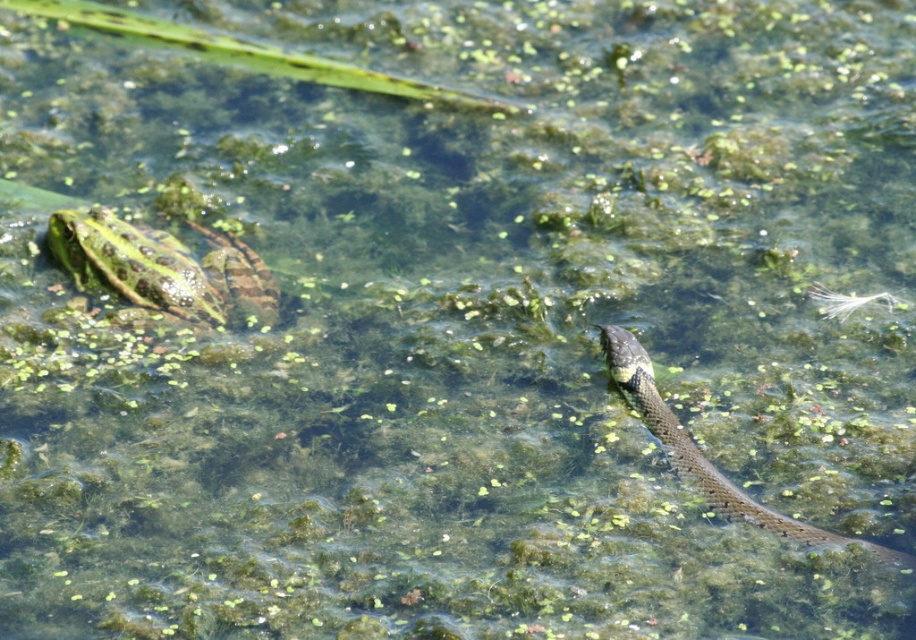
Is speckled green skin at upper left further to the viewer compared to green spotted skin at upper left?

Yes, speckled green skin at upper left is further from the viewer.

Does point (160, 305) come in front of point (628, 384)?

That is False.

The height and width of the screenshot is (640, 916). What are the coordinates of `speckled green skin at upper left` in the screenshot? It's located at (160, 268).